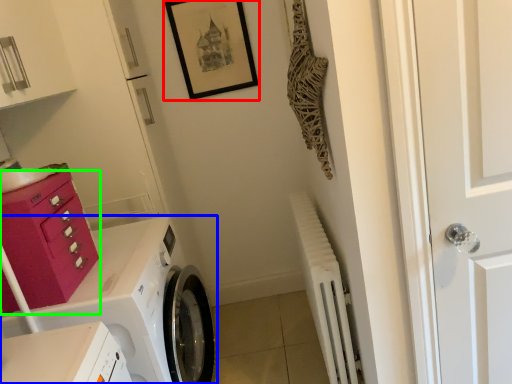
Question: Which object is the farthest from picture frame (highlighted by a red box)? Choose among these: washing machine (highlighted by a blue box) or drawer (highlighted by a green box).

Choices:
 (A) washing machine
 (B) drawer

Answer: (B)